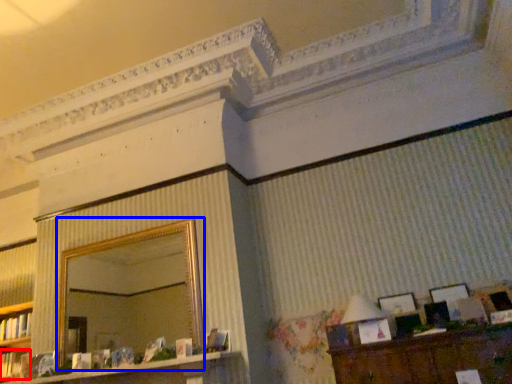
Question: Which of the following is the farthest to the observer, book (highlighted by a red box) or mirror (highlighted by a blue box)?

Choices:
 (A) book
 (B) mirror

Answer: (A)